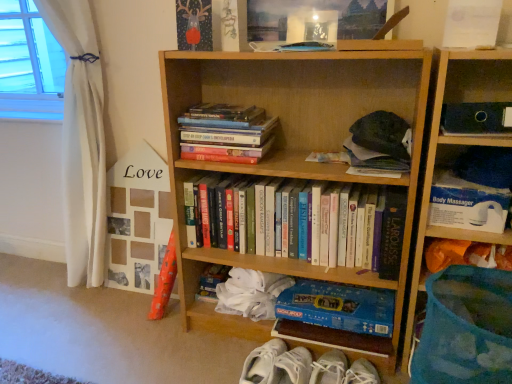
Question: From a real-world perspective, is hardcover books at center, acting as the third book starting from the top, over blue cardboard monopoly game at lower center, the fourth book when ordered from top to bottom?

Choices:
 (A) no
 (B) yes

Answer: (B)

Question: Is hardcover books at center, positioned as the 2th book in bottom-to-top order, bigger than blue cardboard monopoly game at lower center, the fourth book when ordered from top to bottom?

Choices:
 (A) yes
 (B) no

Answer: (A)

Question: Is hardcover books at center, positioned as the 2th book in bottom-to-top order, with blue cardboard monopoly game at lower center, the fourth book when ordered from top to bottom?

Choices:
 (A) yes
 (B) no

Answer: (B)

Question: From a real-world perspective, is hardcover books at center, positioned as the 2th book in bottom-to-top order, beneath blue cardboard monopoly game at lower center, the fourth book when ordered from top to bottom?

Choices:
 (A) no
 (B) yes

Answer: (A)

Question: Can you confirm if hardcover books at center, acting as the third book starting from the top, is taller than blue cardboard monopoly game at lower center, the fourth book when ordered from top to bottom?

Choices:
 (A) yes
 (B) no

Answer: (A)

Question: Considering the relative positions of hardcover books at center, positioned as the 2th book in bottom-to-top order, and blue cardboard monopoly game at lower center, the fourth book when ordered from top to bottom, in the image provided, is hardcover books at center, positioned as the 2th book in bottom-to-top order, to the right of blue cardboard monopoly game at lower center, the fourth book when ordered from top to bottom, from the viewer's perspective?

Choices:
 (A) no
 (B) yes

Answer: (A)

Question: Is blue plastic basket at right, which is the 2th bookcase in left-to-right order, further to camera compared to white fabric sneakers at lower center?

Choices:
 (A) no
 (B) yes

Answer: (A)

Question: From the image's perspective, is blue plastic basket at right, which is the 2th bookcase in left-to-right order, on top of white fabric sneakers at lower center?

Choices:
 (A) yes
 (B) no

Answer: (A)

Question: From a real-world perspective, is blue plastic basket at right, which is the 2th bookcase in left-to-right order, physically below white fabric sneakers at lower center?

Choices:
 (A) no
 (B) yes

Answer: (A)

Question: From the image's perspective, would you say blue plastic basket at right, which is the 2th bookcase in left-to-right order, is shown under white fabric sneakers at lower center?

Choices:
 (A) yes
 (B) no

Answer: (B)

Question: Could you tell me if blue plastic basket at right, the first bookcase when ordered from right to left, is facing white fabric sneakers at lower center?

Choices:
 (A) yes
 (B) no

Answer: (B)

Question: Is the depth of blue plastic basket at right, the first bookcase when ordered from right to left, less than that of white fabric sneakers at lower center?

Choices:
 (A) yes
 (B) no

Answer: (A)

Question: From the image's perspective, is white fabric sneakers at lower center over hardcover books at upper left, which is counted as the second book, starting from the top?

Choices:
 (A) no
 (B) yes

Answer: (A)